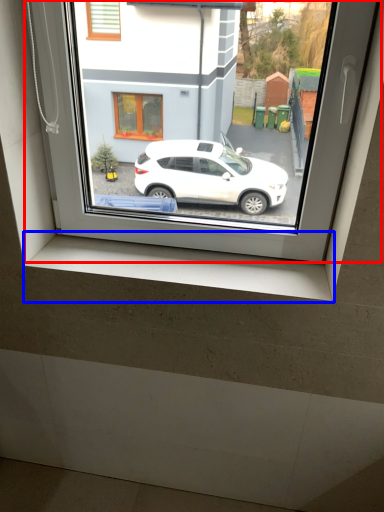
Question: Which of the following is the closest to the observer, window (highlighted by a red box) or window sill (highlighted by a blue box)?

Choices:
 (A) window
 (B) window sill

Answer: (A)